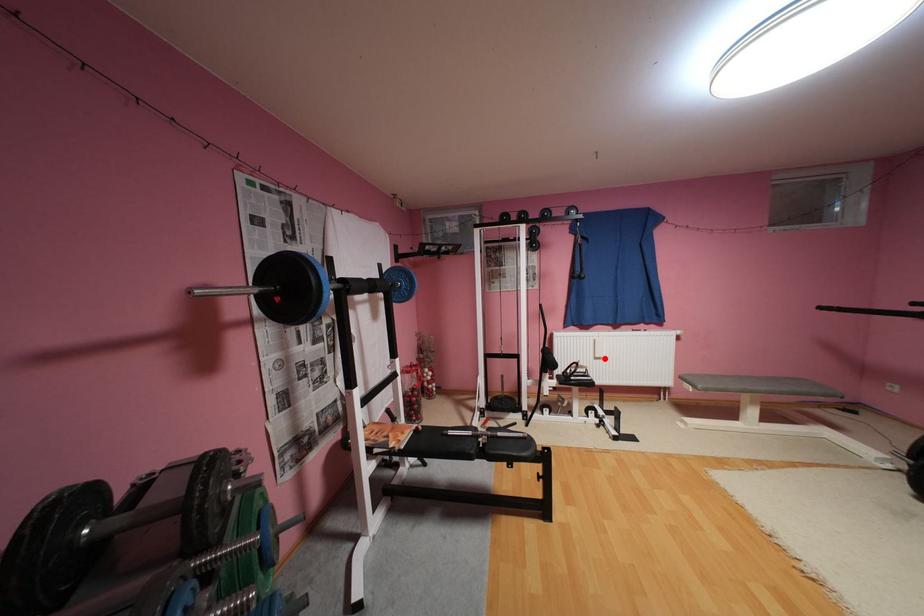
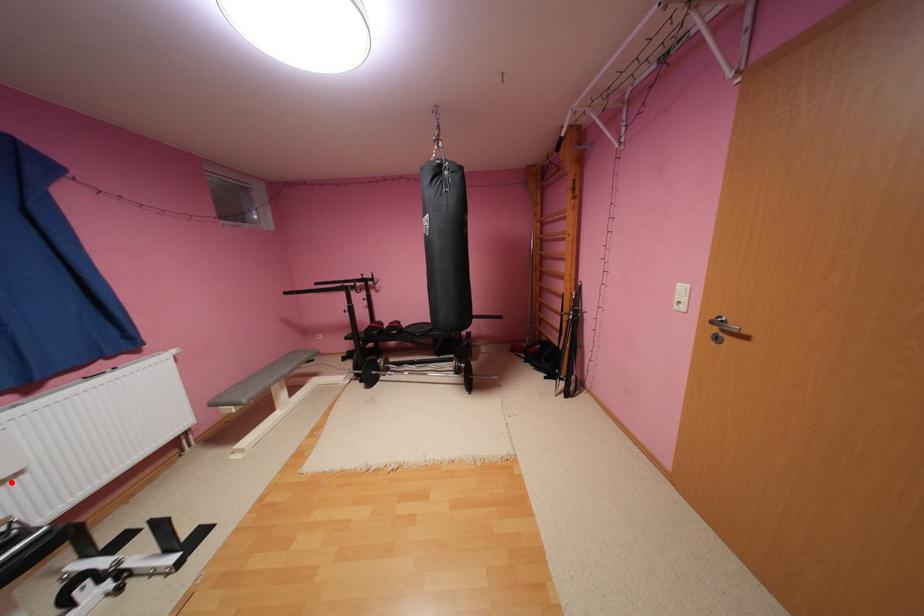
I am providing you with two images of the same scene from different viewpoints. A red point is marked on the first image and another point is marked on the second image. Does the point marked in image1 correspond to the same location as the one in image2?

Yes